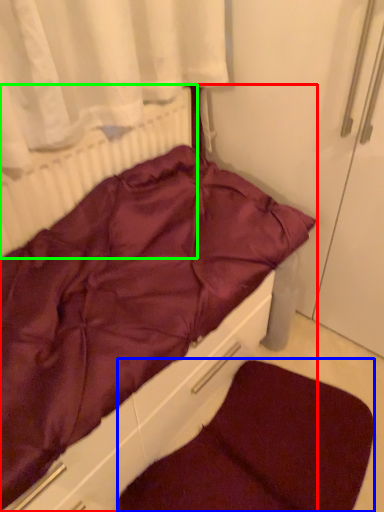
Question: Which object is the farthest from furniture (highlighted by a red box)? Choose among these: dog bed (highlighted by a blue box) or radiator (highlighted by a green box).

Choices:
 (A) dog bed
 (B) radiator

Answer: (A)